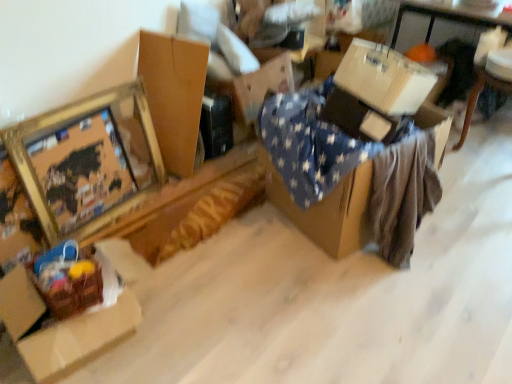
I want to click on vacant area that lies in front of blue star-patterned fabric at center, acting as the 2th table starting from the right, so click(370, 307).